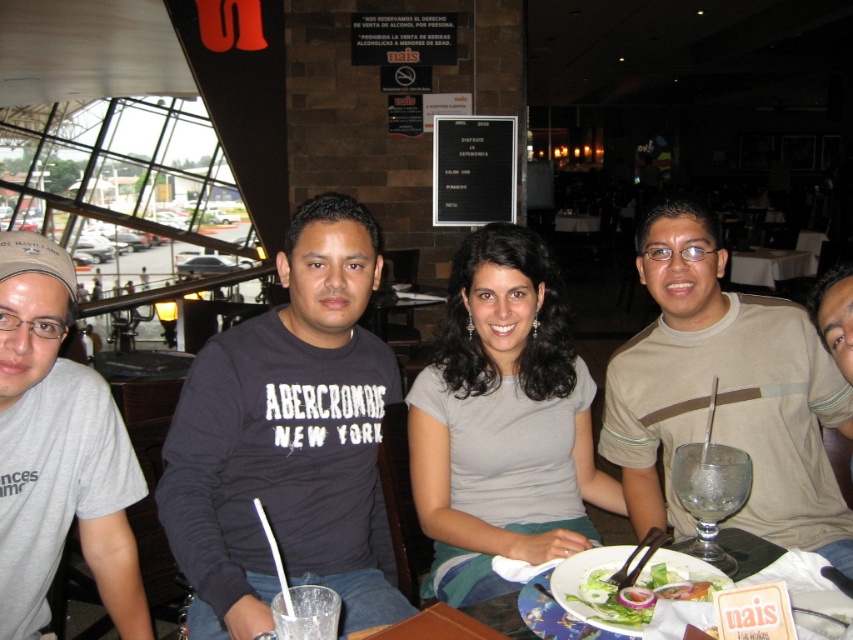
Question: Is dark gray sweatshirt at center closer to the viewer compared to white porcelain plate at center?

Choices:
 (A) yes
 (B) no

Answer: (A)

Question: Estimate the real-world distances between objects in this image. Which object is closer to the white porcelain plate at center?

Choices:
 (A) clear glass table at center
 (B) dark gray sweatshirt at center

Answer: (B)

Question: Which of these objects is positioned farthest from the white porcelain plate at center?

Choices:
 (A) clear glass table at center
 (B) fresh green salad at center

Answer: (A)

Question: Is dark gray sweatshirt at center above beige cotton shirt at center?

Choices:
 (A) yes
 (B) no

Answer: (B)

Question: Which point is farther to the camera?

Choices:
 (A) fresh green salad at center
 (B) beige cotton shirt at center
 (C) dark gray sweatshirt at center

Answer: (B)

Question: Where is beige cotton shirt at center located in relation to clear glass table at center in the image?

Choices:
 (A) below
 (B) above

Answer: (A)